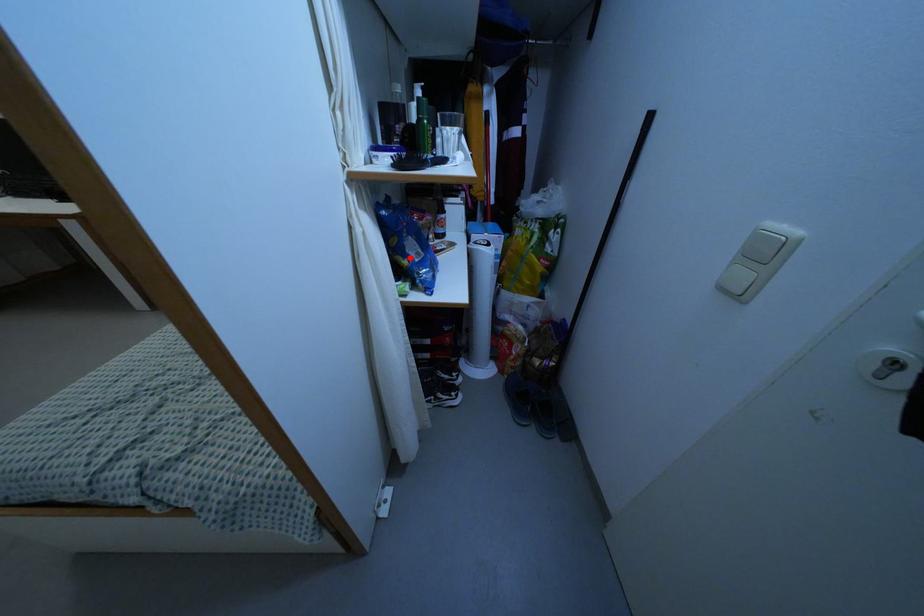
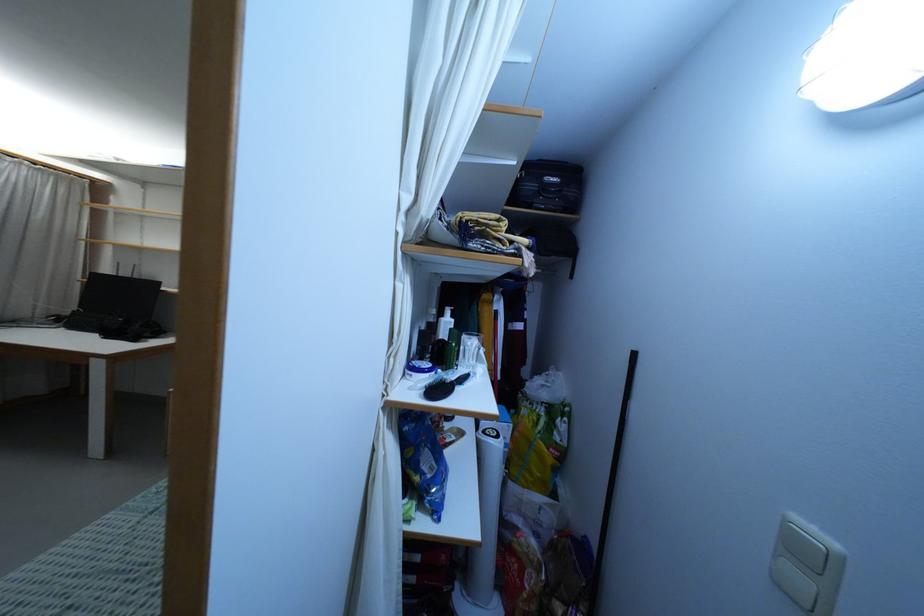
Where in the second image is the point corresponding to the highlighted location from the first image?

(422, 474)